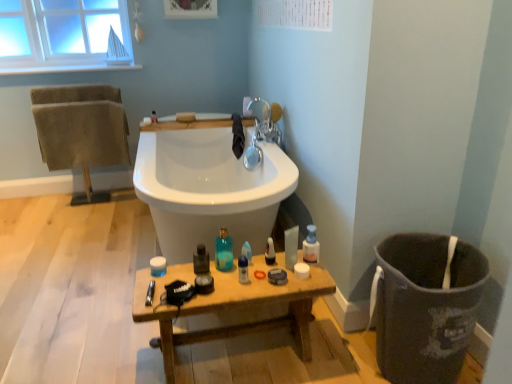
Where is `free space in front of translucent plastic container at center, the second toiletry when ordered from left to right`? This screenshot has width=512, height=384. free space in front of translucent plastic container at center, the second toiletry when ordered from left to right is located at coordinates (163, 286).